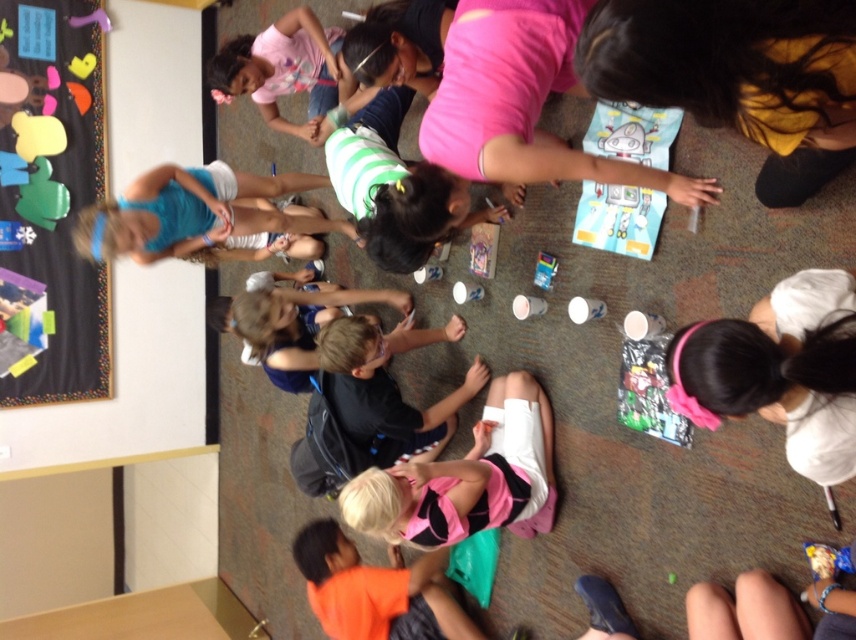
Based on the scene description, which object is wider, the blue fabric dress at upper left or the green striped shirt at center?

The blue fabric dress at upper left is wider than the green striped shirt at center according to the description.

Based on the scene description, which object is positioned lower in the image? The blue fabric dress at upper left or the green striped shirt at center?

The blue fabric dress at upper left is located below the green striped shirt at center, so it is positioned lower in the image.

You are a teacher in the classroom and need to locate the child wearing the yellow fabric shirt at lower right. Based on the coordinates provided, where should you look to find this child?

The yellow fabric shirt at lower right is located at point 0.119 on the x and 0.862 on the y axis, so you should look towards the lower right area of the image to find the child wearing it.